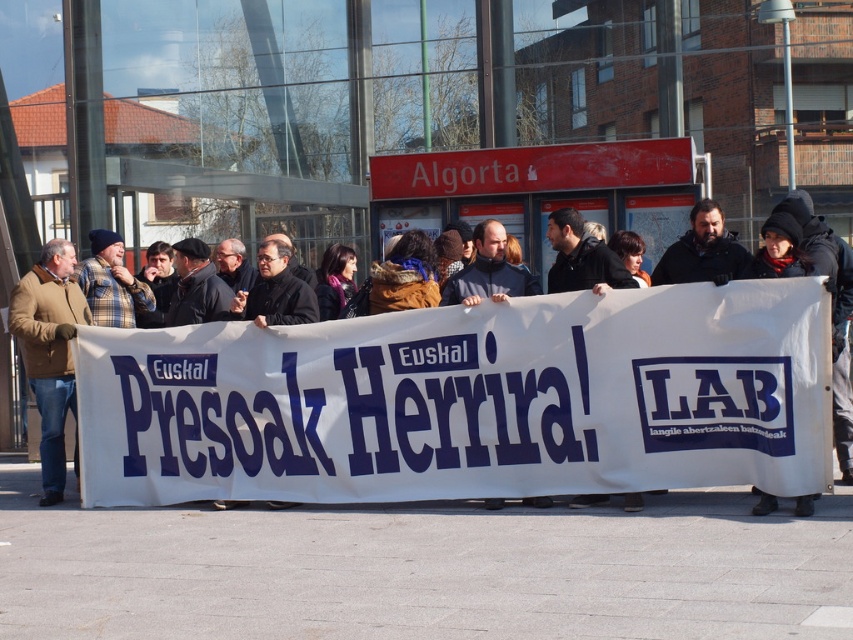
Is point (393, 369) behind point (73, 294)?

That is False.

Between white paper banner at center and brown woolen jacket at left, which one appears on the left side from the viewer's perspective?

From the viewer's perspective, brown woolen jacket at left appears more on the left side.

This screenshot has height=640, width=853. I want to click on white paper banner at center, so (467, 401).